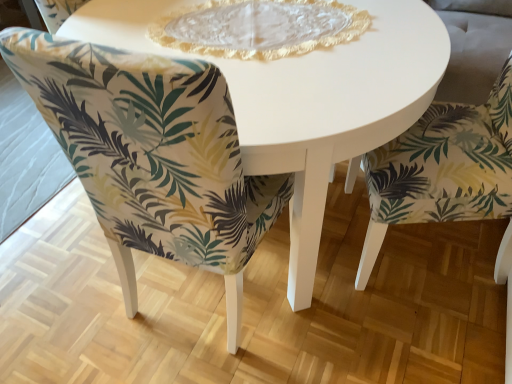
Question: In terms of height, does white glossy table at center look taller or shorter compared to green leaf-patterned fabric chair at center, marked as the 1th chair in a left-to-right arrangement?

Choices:
 (A) short
 (B) tall

Answer: (A)

Question: From a real-world perspective, relative to green leaf-patterned fabric chair at center, which is counted as the second chair, starting from the right, is white glossy table at center vertically above or below?

Choices:
 (A) below
 (B) above

Answer: (A)

Question: Which of these objects is positioned closest to the green leaf-patterned fabric chair at lower right, the second chair positioned from the left?

Choices:
 (A) white glossy table at center
 (B) green leaf-patterned fabric chair at center, which is counted as the second chair, starting from the right

Answer: (A)

Question: Estimate the real-world distances between objects in this image. Which object is farther from the white glossy table at center?

Choices:
 (A) green leaf-patterned fabric chair at center, which is counted as the second chair, starting from the right
 (B) green leaf-patterned fabric chair at lower right, which ranks as the first chair in right-to-left order

Answer: (B)